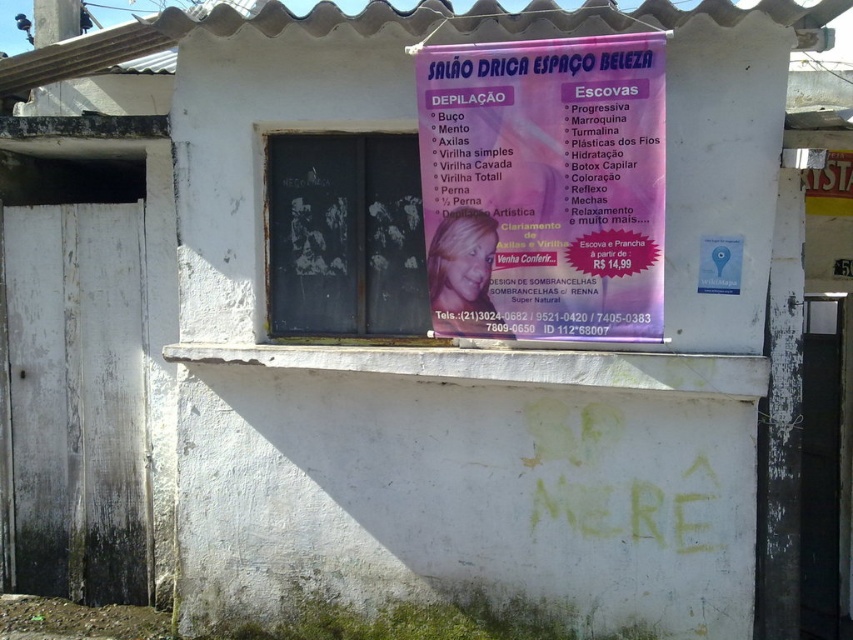
Question: Which of the following is the closest to the observer?

Choices:
 (A) pink paper poster at upper center
 (B) black chalkboard at center

Answer: (A)

Question: Does pink paper poster at upper center have a greater width compared to black chalkboard at center?

Choices:
 (A) yes
 (B) no

Answer: (A)

Question: Which object appears closest to the camera in this image?

Choices:
 (A) black chalkboard at center
 (B) pink paper poster at upper center

Answer: (B)

Question: Can you confirm if pink paper poster at upper center is wider than black chalkboard at center?

Choices:
 (A) no
 (B) yes

Answer: (B)

Question: Which point appears farthest from the camera in this image?

Choices:
 (A) (526, 296)
 (B) (317, 259)

Answer: (B)

Question: Does pink paper poster at upper center appear over black chalkboard at center?

Choices:
 (A) yes
 (B) no

Answer: (A)